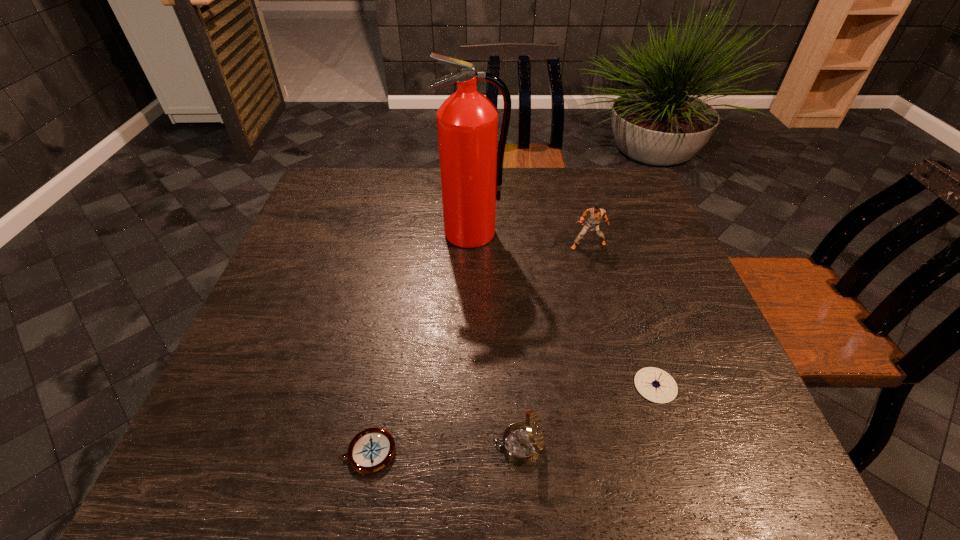
The width and height of the screenshot is (960, 540). Identify the location of free spot at the far right corner of the desktop. (594, 189).

Image resolution: width=960 pixels, height=540 pixels. Find the location of `vacant space at the near right corner of the desktop`. vacant space at the near right corner of the desktop is located at coordinates (749, 489).

Where is `free space that is in between the second shortest object and the fire extinguisher`? free space that is in between the second shortest object and the fire extinguisher is located at coordinates (564, 309).

What are the coordinates of `vacant area that lies between the tallest object and the tallest compass` in the screenshot? It's located at (495, 339).

Where is `free spot between the fourth shortest object and the third shortest object`? This screenshot has height=540, width=960. free spot between the fourth shortest object and the third shortest object is located at coordinates (553, 345).

Find the location of a particular element. Image resolution: width=960 pixels, height=540 pixels. free space between the shortest object and the puncher is located at coordinates (478, 348).

Locate an element on the screen. unoccupied position between the tallest compass and the farthest compass is located at coordinates (587, 415).

Identify the location of free space that is in between the fire extinguisher and the second shortest object. The image size is (960, 540). (564, 309).

Identify the location of free area in between the tallest object and the puncher. (530, 239).

Image resolution: width=960 pixels, height=540 pixels. Identify the location of vacant area between the puncher and the leftmost compass. (478, 348).